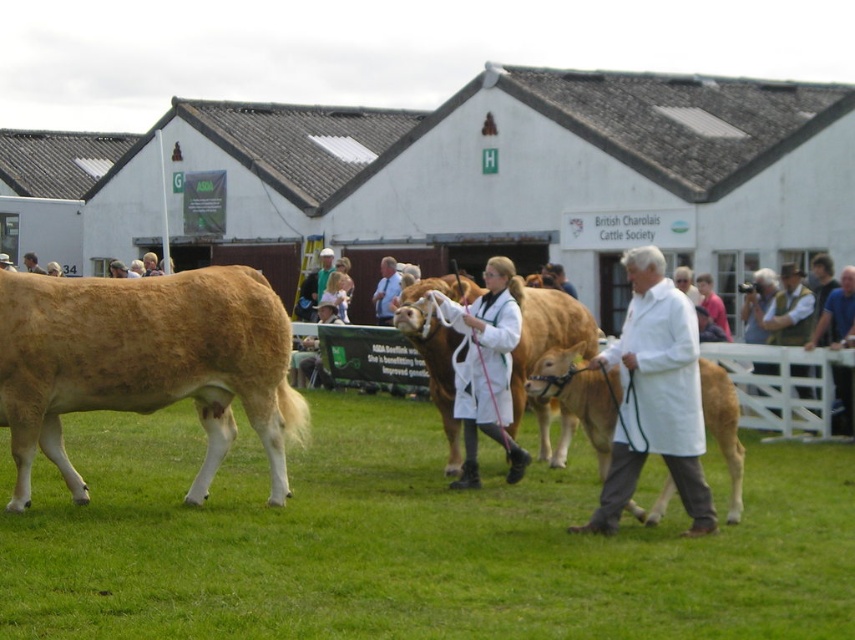
The width and height of the screenshot is (855, 640). In order to click on golden-brown glossy bull at left in this screenshot , I will do `click(145, 364)`.

Which is above, golden-brown glossy bull at left or golden brown leather cow at center?

Positioned higher is golden-brown glossy bull at left.

Where is `golden-brown glossy bull at left`? This screenshot has height=640, width=855. golden-brown glossy bull at left is located at coordinates (145, 364).

Does green grass at center appear on the right side of white lab coat at center?

Incorrect, green grass at center is not on the right side of white lab coat at center.

Is green grass at center positioned behind white lab coat at center?

No, it is in front of white lab coat at center.

Between point (398, 476) and point (635, 408), which one is positioned behind?

The point (398, 476) is more distant.

Find the location of a particular element. This screenshot has height=640, width=855. green grass at center is located at coordinates (405, 541).

Which is more to the right, green grass at center or golden brown leather cow at center?

Positioned to the right is golden brown leather cow at center.

Does point (321, 429) come closer to viewer compared to point (739, 465)?

No, it is not.

Does point (104, 545) lie behind point (553, 364)?

No, (104, 545) is in front of (553, 364).

This screenshot has width=855, height=640. I want to click on green grass at center, so click(405, 541).